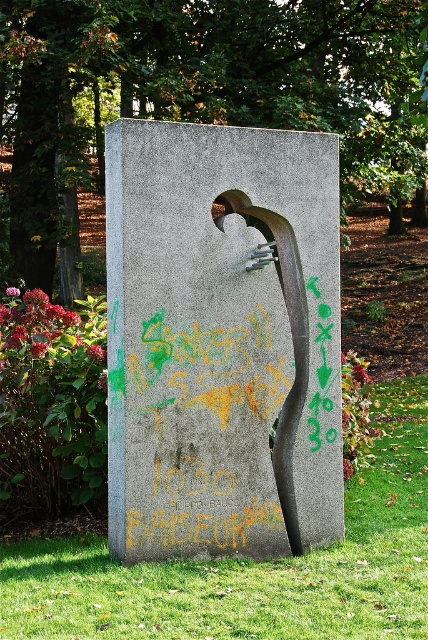
Between gray concrete sculpture at center and green grass at lower center, which one appears on the left side from the viewer's perspective?

Positioned to the left is green grass at lower center.

What do you see at coordinates (222, 340) in the screenshot? I see `gray concrete sculpture at center` at bounding box center [222, 340].

Is point (294, 141) positioned in front of point (418, 515)?

Yes, it is in front of point (418, 515).

Locate an element on the screen. gray concrete sculpture at center is located at coordinates (222, 340).

Is green grass at lower center shorter than yellow graffiti at center?

Yes, green grass at lower center is shorter than yellow graffiti at center.

Is green grass at lower center smaller than yellow graffiti at center?

Indeed, green grass at lower center has a smaller size compared to yellow graffiti at center.

The height and width of the screenshot is (640, 428). What are the coordinates of `green grass at lower center` in the screenshot? It's located at (252, 566).

Who is positioned more to the left, gray concrete sculpture at center or yellow graffiti at center?

yellow graffiti at center

Between point (113, 316) and point (216, 531), which one is positioned behind?

The point (216, 531) is behind.

At what (x,y) coordinates should I click in order to perform the action: click on gray concrete sculpture at center. Please return your answer as a coordinate pair (x, y). The image size is (428, 640). Looking at the image, I should click on (222, 340).